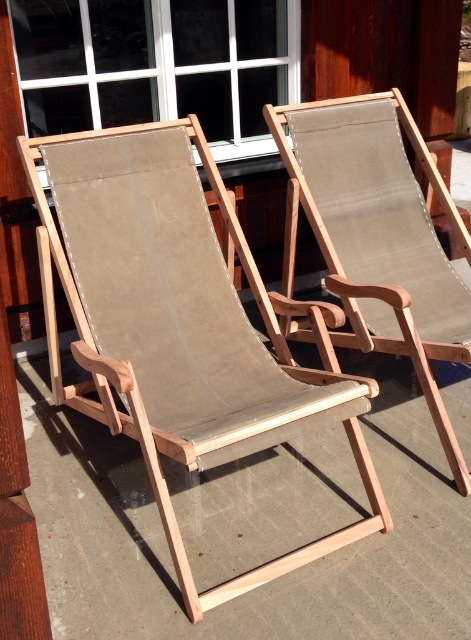
You are standing in front of two wooden deck chairs arranged outdoors. You notice two points marked on the chairs. The first point is at coordinates point (64, 237) and the second is at point (422, 336). Which point is nearer to you?

Point (64, 237) is closer to the viewer than point (422, 336).

You are planning to place a small table between the natural wood beach chair at center and the matte brown fabric chair at center. Which chair should the table be closer to if you want it to be at the same height as the taller chair?

The table should be closer to the matte brown fabric chair at center because it is taller than the natural wood beach chair at center.

You are planning to place a small side table between the natural wood beach chair at center and the matte brown fabric chair at center. Considering their sizes, which chair will have more space between it and the table?

The natural wood beach chair at center is bigger than the matte brown fabric chair at center, so the matte brown fabric chair at center will have more space between it and the table.